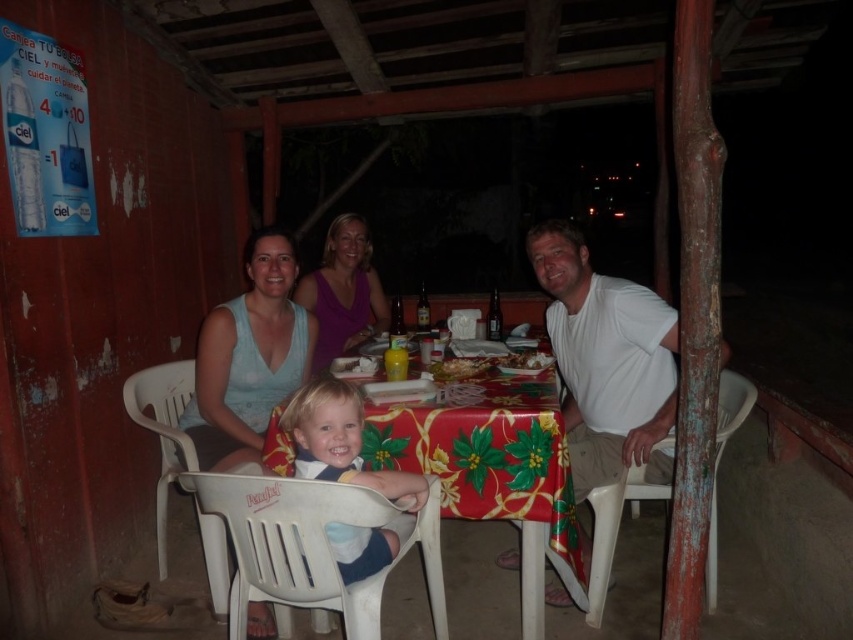
You are sitting at the table in the dining scene and want to reach both the point at location (285, 339) and the point at (376, 532). Which point is closer to you?

The point at (285, 339) is closer to you because it is further to the viewer than the point at (376, 532).

You are a guest at this dinner and need to sit down. There is a light blue fabric dress at center and a blonde hair plastic chair at lower center. Which object is taller?

The light blue fabric dress at center is taller than the blonde hair plastic chair at lower center.

You are sitting at the table in the dining scene. You notice two points marked on the table. The first point is at coordinate point (666, 328) and the second is at point (460, 372). If you want to place a small dish between these two points so it is closer to the first point, where should you position it?

To place the small dish closer to point (666, 328), position it between the two points but nearer to the first point. Since point (666, 328) is in front of point (460, 372), the dish should be placed closer to the first point along the line connecting them.